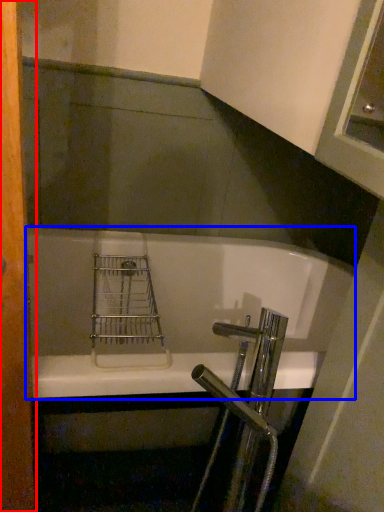
Question: Among these objects, which one is farthest to the camera, screen door (highlighted by a red box) or bathtub (highlighted by a blue box)?

Choices:
 (A) screen door
 (B) bathtub

Answer: (B)